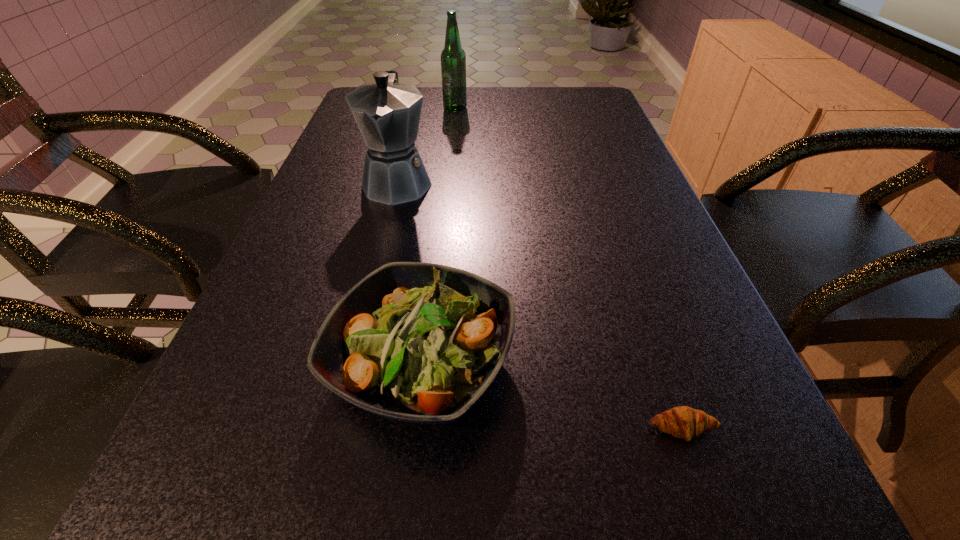
The width and height of the screenshot is (960, 540). Identify the location of beer bottle. (453, 58).

Where is `coffeepot`? The height and width of the screenshot is (540, 960). coffeepot is located at coordinates (387, 113).

You are a GUI agent. You are given a task and a screenshot of the screen. Output one action in this format:
    pyautogui.click(x=<x>, y=<y>)
    Task: Click on the second shortest object
    Image resolution: width=960 pixels, height=540 pixels.
    Given the screenshot: What is the action you would take?
    pyautogui.click(x=417, y=342)

You are a GUI agent. You are given a task and a screenshot of the screen. Output one action in this format:
    pyautogui.click(x=<x>, y=<y>)
    Task: Click on the pastry
    
    Given the screenshot: What is the action you would take?
    pyautogui.click(x=684, y=422)

Identify the location of the shortest object. (684, 422).

Identify the location of vacant space situated 0.220m on the label of the farthest object. (451, 150).

Identify the location of free space located 0.350m at the spout of the coffeepot. (358, 340).

Locate an element on the screen. The width and height of the screenshot is (960, 540). vacant area situated on the left of the salad plate is located at coordinates (257, 362).

Find the location of a particular element. vacant space located 0.060m on the front-facing side of the pastry is located at coordinates (704, 492).

The width and height of the screenshot is (960, 540). Identify the location of object located at the far edge. (453, 58).